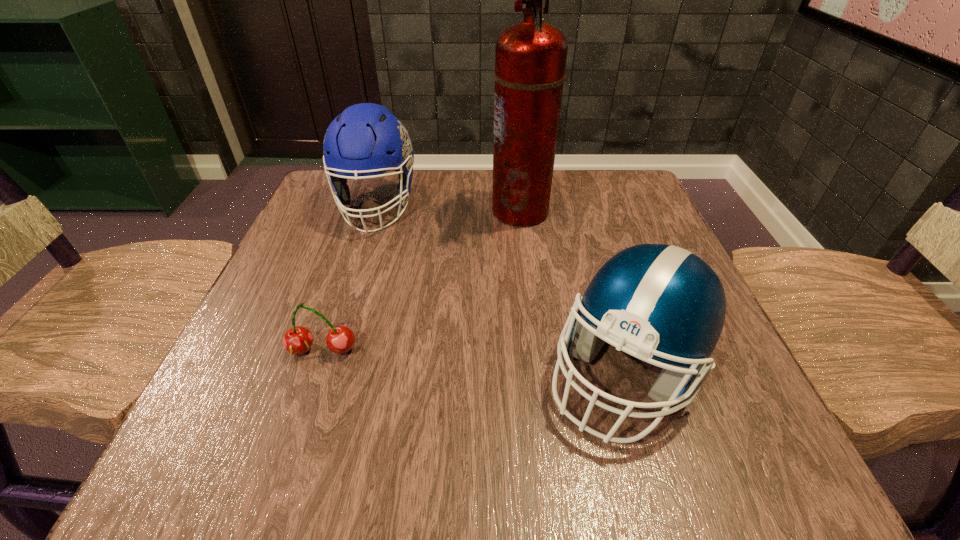
This screenshot has width=960, height=540. In the image, there is a desktop. Identify the location of vacant space at the far left corner. (372, 195).

Find the location of a particular element. The width and height of the screenshot is (960, 540). vacant space at the near left corner is located at coordinates (x=306, y=452).

Find the location of a particular element. The image size is (960, 540). vacant space at the far right corner is located at coordinates (629, 172).

This screenshot has width=960, height=540. What are the coordinates of `vacant space at the near right corner of the desktop` in the screenshot? It's located at (726, 419).

This screenshot has height=540, width=960. In order to click on free area in between the fire extinguisher and the right football helmet in this screenshot , I will do tap(573, 291).

Identify the location of unoccupied position between the left football helmet and the cherry. (349, 278).

Where is `vacant area between the farther football helmet and the cherry`? The image size is (960, 540). vacant area between the farther football helmet and the cherry is located at coordinates coord(349,278).

Identify the location of free spot between the right football helmet and the shortest object. Image resolution: width=960 pixels, height=540 pixels. (474, 361).

In order to click on free space between the fire extinguisher and the right football helmet in this screenshot , I will do 573,291.

Where is `blank region between the fire extinguisher and the shortest object`? This screenshot has width=960, height=540. blank region between the fire extinguisher and the shortest object is located at coordinates (421, 280).